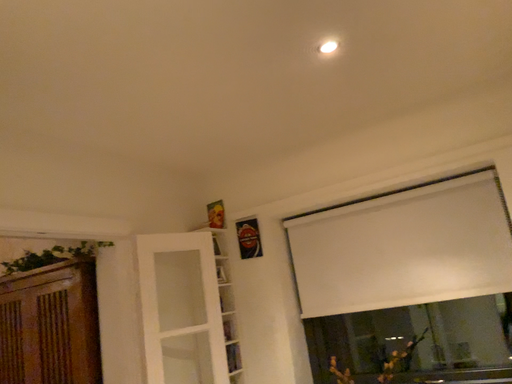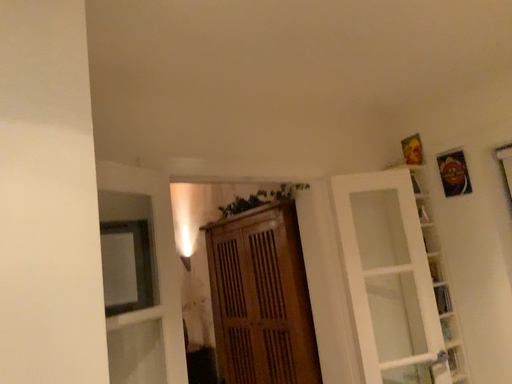
Question: Which way did the camera rotate in the video?

Choices:
 (A) rotated upward
 (B) rotated downward

Answer: (B)